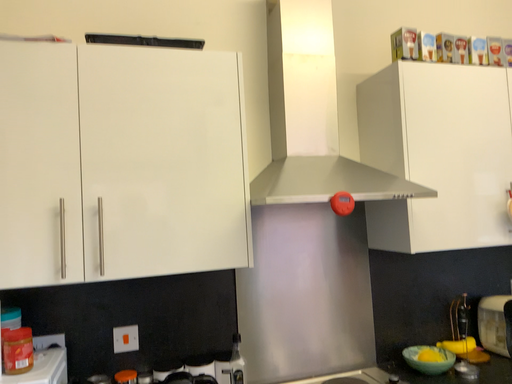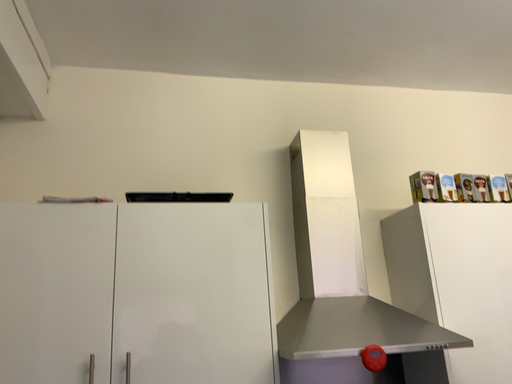
Question: Which way did the camera rotate in the video?

Choices:
 (A) rotated upward
 (B) rotated downward

Answer: (A)